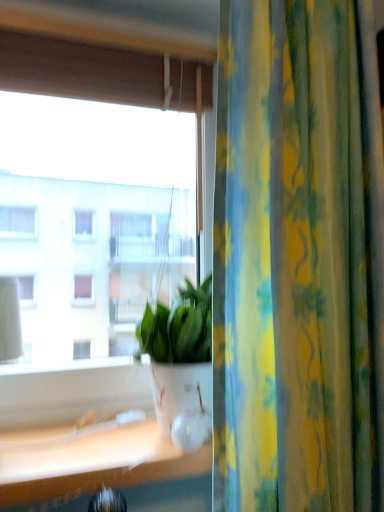
What do you see at coordinates (179, 352) in the screenshot? I see `white glossy pot at center` at bounding box center [179, 352].

The image size is (384, 512). I want to click on white glossy pot at center, so click(x=179, y=352).

This screenshot has width=384, height=512. I want to click on white glossy pot at center, so pos(179,352).

Can you tell me how much yellow-green floral fabric curtain at right and transparent glass window at center differ in facing direction?

The angle between the facing direction of yellow-green floral fabric curtain at right and the facing direction of transparent glass window at center is 0.15 degrees.

Is yellow-green floral fabric curtain at right surrounding transparent glass window at center?

No, transparent glass window at center is located outside of yellow-green floral fabric curtain at right.

Are yellow-green floral fabric curtain at right and transparent glass window at center far apart?

No, yellow-green floral fabric curtain at right is not far from transparent glass window at center.

Locate an element on the screen. The image size is (384, 512). curtain below the transparent glass window at center (from the image's perspective) is located at coordinates (298, 259).

The width and height of the screenshot is (384, 512). Find the location of `curtain on the right of white glossy pot at center`. curtain on the right of white glossy pot at center is located at coordinates (298, 259).

Is yellow-green floral fabric curtain at right looking in the opposite direction of white glossy pot at center?

Yes, yellow-green floral fabric curtain at right is positioned with its back facing white glossy pot at center.

Does yellow-green floral fabric curtain at right appear on the right side of white glossy pot at center?

Correct, you'll find yellow-green floral fabric curtain at right to the right of white glossy pot at center.

From the image's perspective, is yellow-green floral fabric curtain at right positioned above or below white glossy pot at center?

yellow-green floral fabric curtain at right is situated higher than white glossy pot at center in the image.

Who is smaller, transparent glass window at center or white glossy pot at center?

With smaller size is white glossy pot at center.

From the image's perspective, which object appears higher, transparent glass window at center or white glossy pot at center?

From the image's view, transparent glass window at center is above.

Where is `window lying on the left of white glossy pot at center`? The image size is (384, 512). window lying on the left of white glossy pot at center is located at coordinates coord(94,189).

Does transparent glass window at center appear on the left side of white glossy pot at center?

Indeed, transparent glass window at center is positioned on the left side of white glossy pot at center.

Which of these two, transparent glass window at center or yellow-green floral fabric curtain at right, is bigger?

transparent glass window at center is bigger.

Which object is closer to the camera taking this photo, transparent glass window at center or yellow-green floral fabric curtain at right?

yellow-green floral fabric curtain at right is more forward.

From a real-world perspective, is transparent glass window at center positioned over yellow-green floral fabric curtain at right based on gravity?

Yes, from a real-world perspective, transparent glass window at center is on top of yellow-green floral fabric curtain at right.

Is white glossy pot at center at the right side of yellow-green floral fabric curtain at right?

No.

Between white glossy pot at center and yellow-green floral fabric curtain at right, which one has larger width?

Wider between the two is white glossy pot at center.

Are white glossy pot at center and yellow-green floral fabric curtain at right located far from each other?

No, there isn't a large distance between white glossy pot at center and yellow-green floral fabric curtain at right.

At what (x,y) coordinates should I click in order to perform the action: click on curtain above the white glossy pot at center (from a real-world perspective). Please return your answer as a coordinate pair (x, y). The width and height of the screenshot is (384, 512). Looking at the image, I should click on tap(298, 259).

Would you say white glossy pot at center is to the left or to the right of transparent glass window at center in the picture?

From the image, it's evident that white glossy pot at center is to the right of transparent glass window at center.

Can you confirm if white glossy pot at center is wider than transparent glass window at center?

Yes, white glossy pot at center is wider than transparent glass window at center.

Which object is further away from the camera taking this photo, white glossy pot at center or transparent glass window at center?

Positioned behind is transparent glass window at center.

Identify the location of curtain lying below the transparent glass window at center (from the image's perspective). This screenshot has height=512, width=384. (298, 259).

Find the location of `houseplant that appears behind the yellow-green floral fabric curtain at right`. houseplant that appears behind the yellow-green floral fabric curtain at right is located at coordinates (179, 352).

When comparing their distances from white glossy pot at center, does transparent glass window at center or yellow-green floral fabric curtain at right seem closer?

yellow-green floral fabric curtain at right is positioned closer to the anchor white glossy pot at center.

Consider the image. From the image, which object appears to be farther from yellow-green floral fabric curtain at right, white glossy pot at center or transparent glass window at center?

Among the two, transparent glass window at center is located further to yellow-green floral fabric curtain at right.

Estimate the real-world distances between objects in this image. Which object is further from white glossy pot at center, yellow-green floral fabric curtain at right or transparent glass window at center?

transparent glass window at center is further to white glossy pot at center.

When comparing their distances from yellow-green floral fabric curtain at right, does transparent glass window at center or white glossy pot at center seem further?

The object further to yellow-green floral fabric curtain at right is transparent glass window at center.

Looking at the image, which one is located closer to transparent glass window at center, yellow-green floral fabric curtain at right or white glossy pot at center?

white glossy pot at center is positioned closer to the anchor transparent glass window at center.

Which object lies nearer to the anchor point transparent glass window at center, white glossy pot at center or yellow-green floral fabric curtain at right?

Among the two, white glossy pot at center is located nearer to transparent glass window at center.

Image resolution: width=384 pixels, height=512 pixels. I want to click on houseplant situated between transparent glass window at center and yellow-green floral fabric curtain at right from left to right, so click(179, 352).